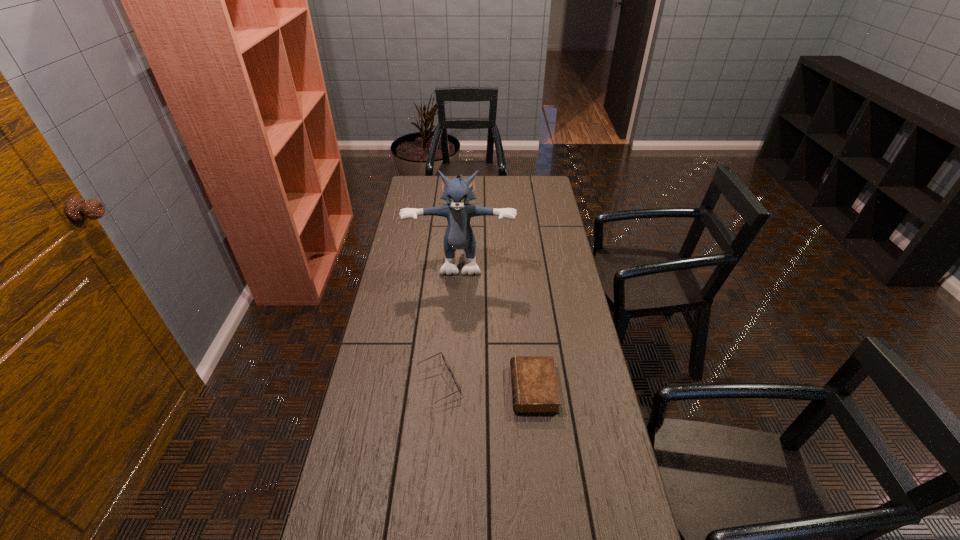
Identify which object is the second nearest to the spectacles. Please provide its 2D coordinates. Your answer should be formatted as a tuple, i.e. [(x, y)], where the tuple contains the x and y coordinates of a point satisfying the conditions above.

[(459, 235)]

What are the coordinates of `the closest object to the cat` in the screenshot? It's located at (459, 389).

Where is `vacant space that satisfies the following two spatial constraints: 1. on the front-facing side of the cat; 2. with the lenses facing outward on the spectacles`? Image resolution: width=960 pixels, height=540 pixels. vacant space that satisfies the following two spatial constraints: 1. on the front-facing side of the cat; 2. with the lenses facing outward on the spectacles is located at coordinates (454, 383).

Where is `free spot that satisfies the following two spatial constraints: 1. on the front-facing side of the cat; 2. with the lenses facing outward on the spectacles`? free spot that satisfies the following two spatial constraints: 1. on the front-facing side of the cat; 2. with the lenses facing outward on the spectacles is located at coordinates (454, 383).

At what (x,y) coordinates should I click in order to perform the action: click on vacant region that satisfies the following two spatial constraints: 1. on the front-facing side of the tallest object; 2. with the lenses facing outward on the spectacles. Please return your answer as a coordinate pair (x, y). The height and width of the screenshot is (540, 960). Looking at the image, I should click on (454, 383).

You are a GUI agent. You are given a task and a screenshot of the screen. Output one action in this format:
    pyautogui.click(x=<x>, y=<y>)
    Task: Click on the vacant space that satisfies the following two spatial constraints: 1. on the front-facing side of the farthest object; 2. with the lenses facing outward on the spectacles
    The image size is (960, 540).
    Given the screenshot: What is the action you would take?
    pyautogui.click(x=454, y=383)